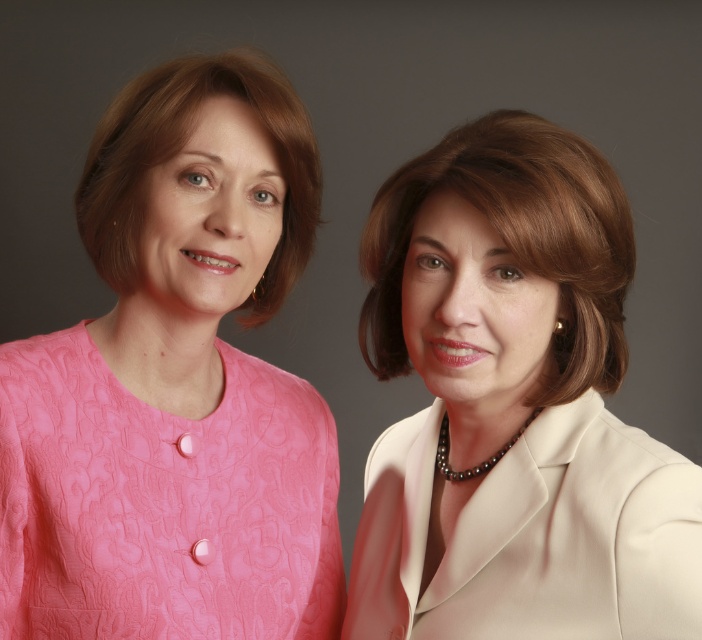
Can you confirm if pink textured dress at left is positioned above white satin blazer at right?

Correct, pink textured dress at left is located above white satin blazer at right.

Which of these two, pink textured dress at left or white satin blazer at right, stands shorter?

Standing shorter between the two is white satin blazer at right.

This screenshot has height=640, width=702. In order to click on pink textured dress at left in this screenshot , I will do `click(161, 502)`.

The image size is (702, 640). I want to click on pink textured dress at left, so click(161, 502).

Is white satin blazer at center below white satin blazer at right?

No.

Looking at this image, does white satin blazer at center have a larger size compared to white satin blazer at right?

Yes.

Does point (399, 614) lie behind point (529, 522)?

Yes, point (399, 614) is behind point (529, 522).

Identify the location of white satin blazer at center. Image resolution: width=702 pixels, height=640 pixels. (512, 404).

Is white satin blazer at center positioned in front of pink textured dress at left?

Yes, white satin blazer at center is in front of pink textured dress at left.

Between white satin blazer at center and pink textured dress at left, which one appears on the right side from the viewer's perspective?

From the viewer's perspective, white satin blazer at center appears more on the right side.

The height and width of the screenshot is (640, 702). What do you see at coordinates (512, 404) in the screenshot?
I see `white satin blazer at center` at bounding box center [512, 404].

The image size is (702, 640). What are the coordinates of `white satin blazer at center` in the screenshot? It's located at (512, 404).